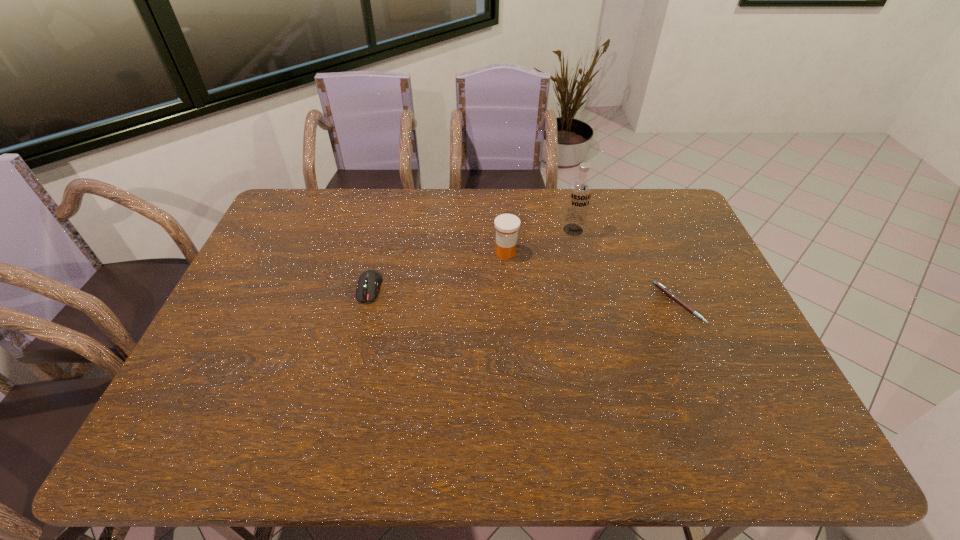
Image resolution: width=960 pixels, height=540 pixels. Find the location of `computer equipment`. computer equipment is located at coordinates (369, 281).

Where is `the third tallest object`? The image size is (960, 540). the third tallest object is located at coordinates (369, 281).

Image resolution: width=960 pixels, height=540 pixels. I want to click on the shortest object, so click(x=669, y=293).

At what (x,y) coordinates should I click in order to perform the action: click on the rightmost object. Please return your answer as a coordinate pair (x, y). This screenshot has width=960, height=540. Looking at the image, I should click on (669, 293).

At what (x,y) coordinates should I click in order to perform the action: click on vodka. Please return your answer as a coordinate pair (x, y). Image resolution: width=960 pixels, height=540 pixels. Looking at the image, I should click on (580, 189).

At what (x,y) coordinates should I click in order to perform the action: click on the third object from left to right. Please return your answer as a coordinate pair (x, y). This screenshot has width=960, height=540. Looking at the image, I should click on (580, 189).

At what (x,y) coordinates should I click in order to perform the action: click on the third nearest object. Please return your answer as a coordinate pair (x, y). The width and height of the screenshot is (960, 540). Looking at the image, I should click on (507, 225).

Locate an element on the screen. The height and width of the screenshot is (540, 960). medicine is located at coordinates (507, 225).

Where is `free point located on the button of the computer equipment`? free point located on the button of the computer equipment is located at coordinates (342, 401).

The height and width of the screenshot is (540, 960). Identify the location of vacant region located at the nib of the rightmost object. (714, 303).